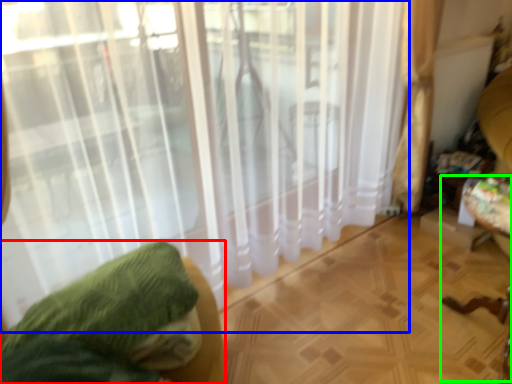
Question: Which object is positioned farthest from furniture (highlighted by a red box)? Select from curtain (highlighted by a blue box) and swivel chair (highlighted by a green box).

Choices:
 (A) curtain
 (B) swivel chair

Answer: (B)